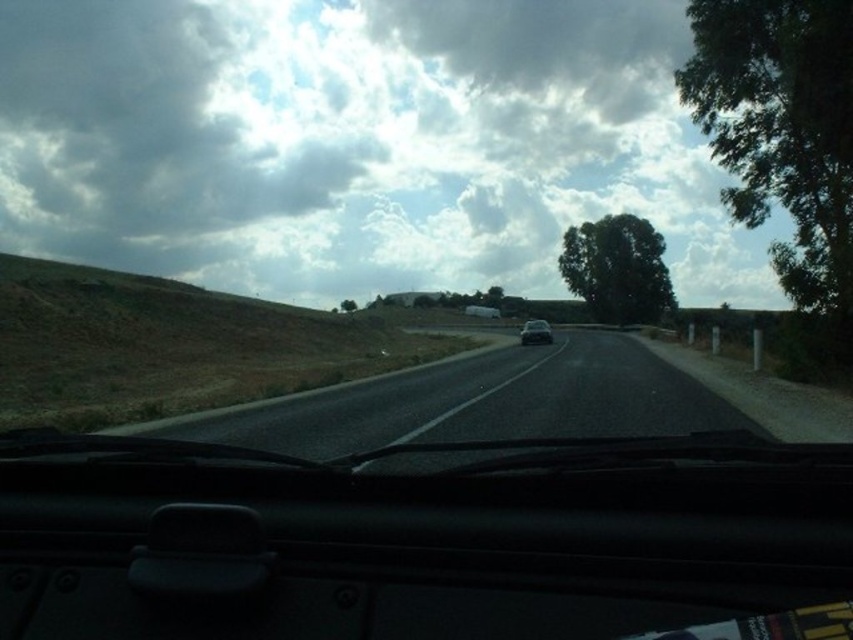
Between point (611, 60) and point (782, 192), which one is positioned behind?

Point (611, 60)

Where is `cloudy sky at upper center`? The height and width of the screenshot is (640, 853). cloudy sky at upper center is located at coordinates (358, 144).

Does green leafy tree at right have a smaller size compared to green leafy tree at upper center?

Incorrect, green leafy tree at right is not smaller in size than green leafy tree at upper center.

Who is positioned more to the left, green leafy tree at right or green leafy tree at upper center?

green leafy tree at upper center is more to the left.

Describe the element at coordinates (784, 144) in the screenshot. I see `green leafy tree at right` at that location.

Find the location of a particular element. This screenshot has width=853, height=640. green leafy tree at right is located at coordinates (784, 144).

Can you confirm if transparent glass windshield at center is positioned to the right of green leafy tree at center?

No, transparent glass windshield at center is not to the right of green leafy tree at center.

Is transparent glass windshield at center thinner than green leafy tree at center?

Incorrect, transparent glass windshield at center's width is not less than green leafy tree at center's.

Identify the location of transparent glass windshield at center. (425, 540).